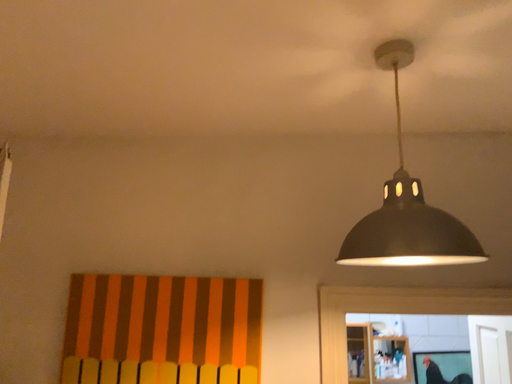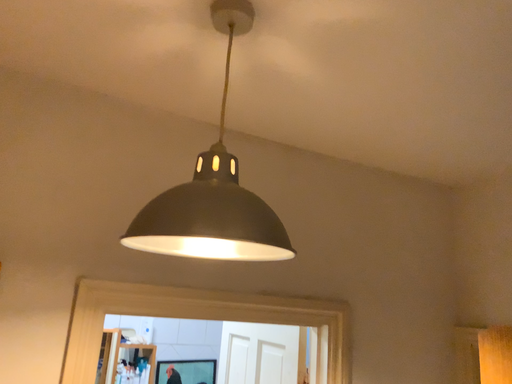
Question: Which way did the camera rotate in the video?

Choices:
 (A) rotated left
 (B) rotated right

Answer: (B)